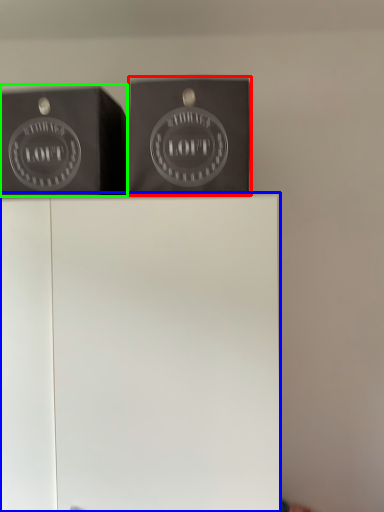
Question: Considering the real-world distances, which object is closest to package (highlighted by a red box)? furniture (highlighted by a blue box) or writing (highlighted by a green box).

Choices:
 (A) furniture
 (B) writing

Answer: (B)